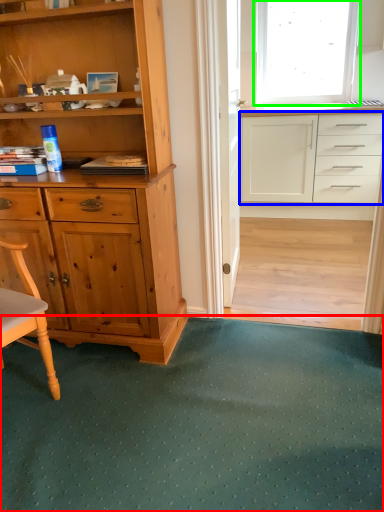
Question: Which object is positioned farthest from doormat (highlighted by a red box)? Select from cabinetry (highlighted by a blue box) and window (highlighted by a green box).

Choices:
 (A) cabinetry
 (B) window

Answer: (B)